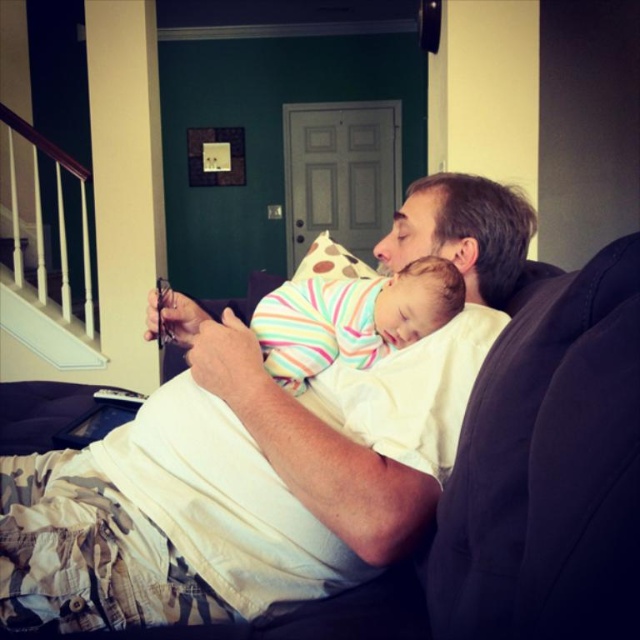
You are a clothing designer observing this scene. You need to determine which garment has a greater width between the white cotton shirt at center and the striped cotton onesie at center. Which one is wider?

The white cotton shirt at center has a larger width than the striped cotton onesie at center according to the description.